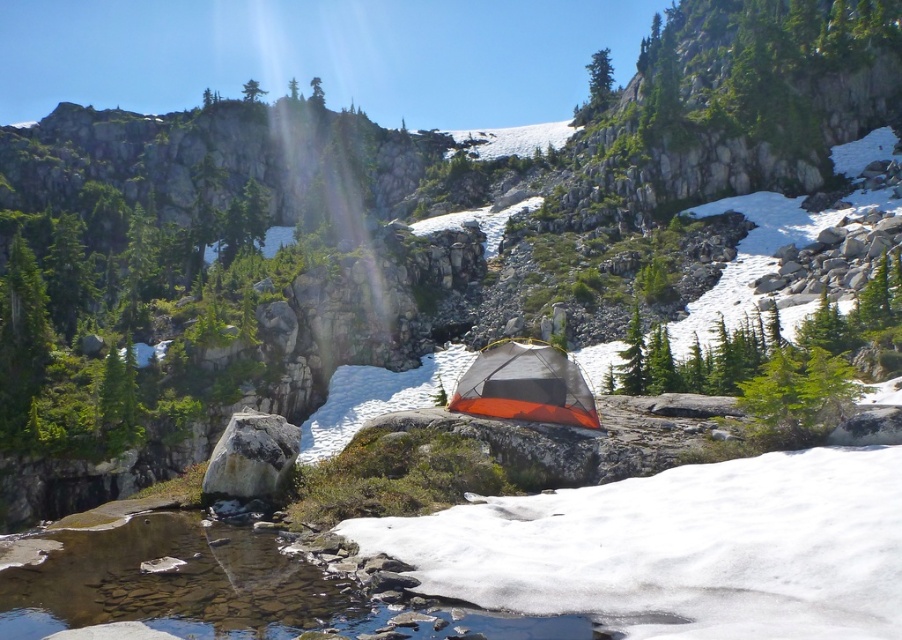
You are a hiker trying to cross the mountain terrain. You see the white fluffy snow at center and the gray rock at center. Which object is located below the other?

The white fluffy snow at center is positioned under the gray rock at center, so the snow is below the rock.

You are planning to cross the creek and need to know if the clear water at creek center is deeper than the gray rock at center. Can you determine this based on the scene?

The clear water at creek center is shorter than gray rock at center, so the water is not deeper than the rock.

You are standing at the edge of the small body of water in the foreground of the mountain landscape. You see two points marked in the scene. Which point, point (229,612) or point (209,456), is closer to you?

Point (229,612) is closer to the viewer than point (209,456).